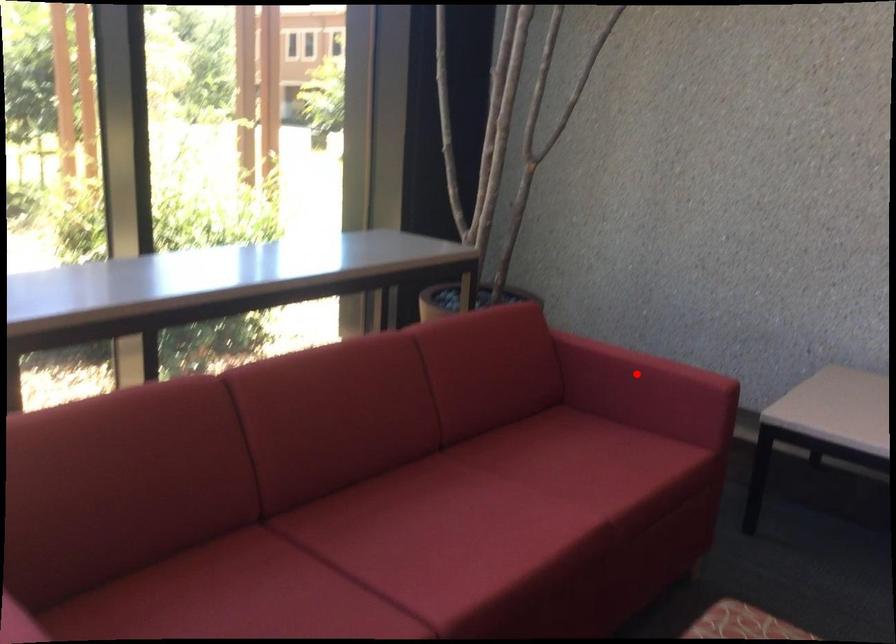
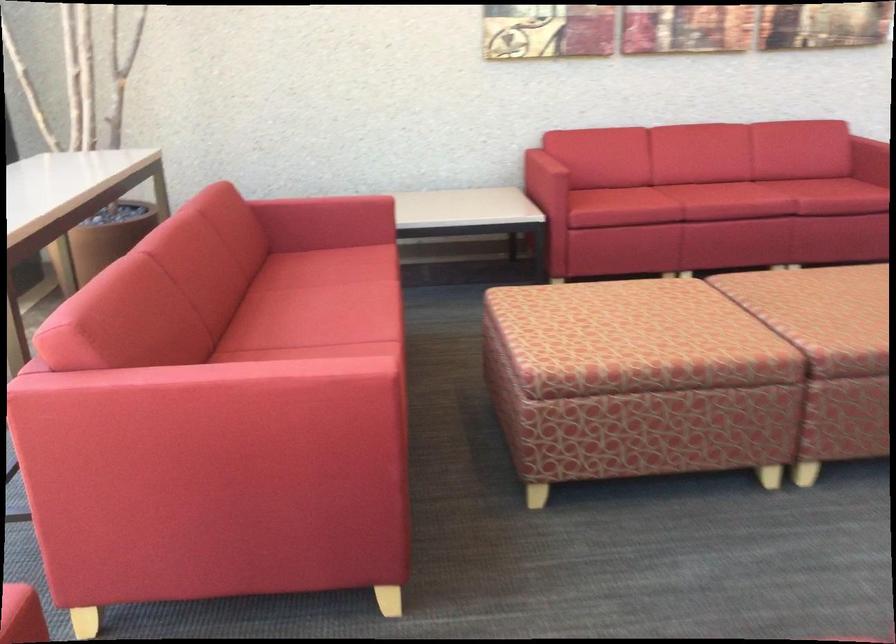
Question: I am providing you with two images of the same scene from different viewpoints. In image1, a red point is highlighted. Considering the same 3D point in image2, which of the following is correct?

Choices:
 (A) It is closer
 (B) It is farther

Answer: (B)